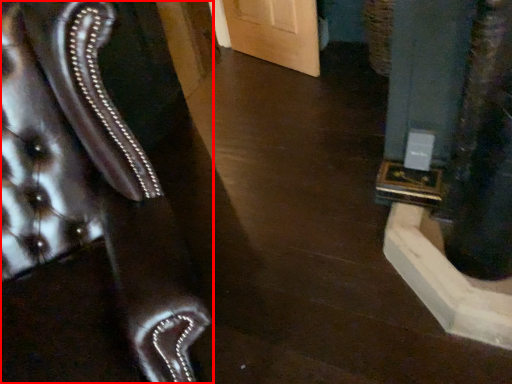
Question: Where is furniture (annotated by the red box) located in relation to pillar in the image?

Choices:
 (A) left
 (B) right

Answer: (A)